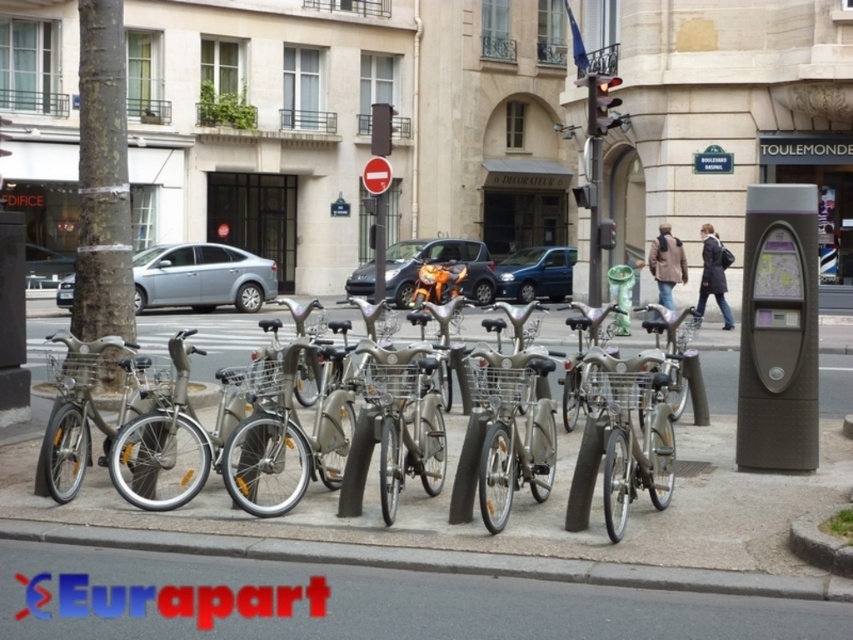
Question: Which point is closer to the camera?

Choices:
 (A) (105, 545)
 (B) (809, 413)

Answer: (A)

Question: Among these objects, which one is farthest from the camera?

Choices:
 (A) silver metallic bicycle at center
 (B) gray concrete curb at lower center
 (C) matte gray parking meter at right

Answer: (C)

Question: Does silver metallic bicycle at center come behind matte gray parking meter at right?

Choices:
 (A) yes
 (B) no

Answer: (B)

Question: From the image, what is the correct spatial relationship of silver metallic bicycle at center in relation to matte gray parking meter at right?

Choices:
 (A) below
 (B) above

Answer: (A)

Question: Does silver metallic bicycle at center appear over gray concrete curb at lower center?

Choices:
 (A) yes
 (B) no

Answer: (A)

Question: Which object appears closest to the camera in this image?

Choices:
 (A) gray concrete curb at lower center
 (B) matte gray parking meter at right
 (C) silver metallic bicycle at center

Answer: (A)